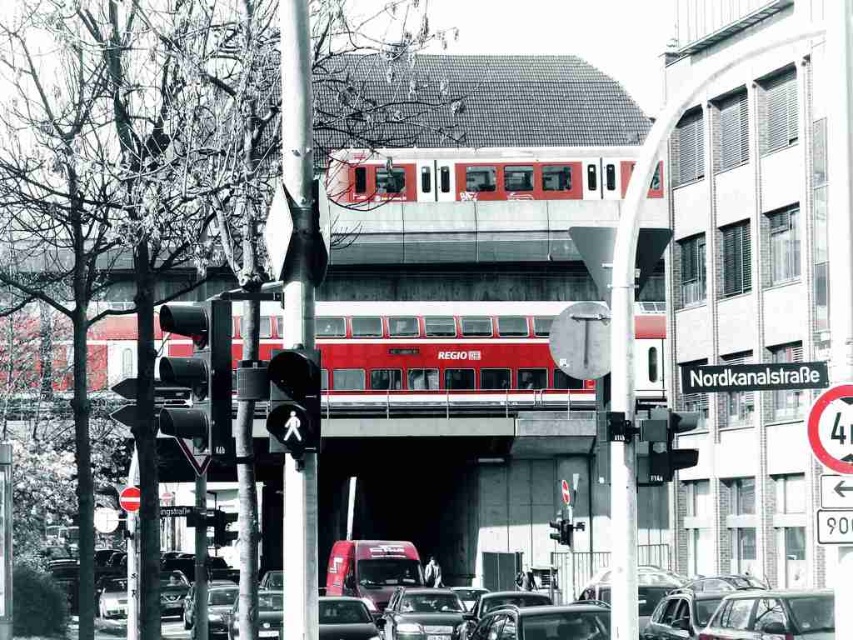
Consider the image. You are a pedestrian waiting at the traffic light. You need to cross the street to reach the red van parked on the other side. The traffic light you are waiting at is at point (199,376). The red van is at point 0.7, 0.3. Can you safely cross the street from the traffic light to the red van without entering the path of the train on the bridge?

The matte black traffic light at left is located at point (199,376). The red van is at point 0.7, 0.3. Since the traffic light and the red van are both on the street level and the train is on the bridge above, you can safely cross the street from the traffic light to the red van without entering the path of the train on the bridge.

You are standing on the street looking at the train bridge. There are two points marked on the bridge structure. Which point, point 1 at coordinates [294,484] or point 2 at coordinates [695,387], is closer to you?

Point 1 at coordinates [294,484] is closer to the viewer than point 2 at coordinates [695,387].

You are a self driving car approaching the matte black traffic light at left. What is the 2D coordinate of the traffic light you need to stop at?

The matte black traffic light at left is located at the 2D coordinate point of (199, 376).